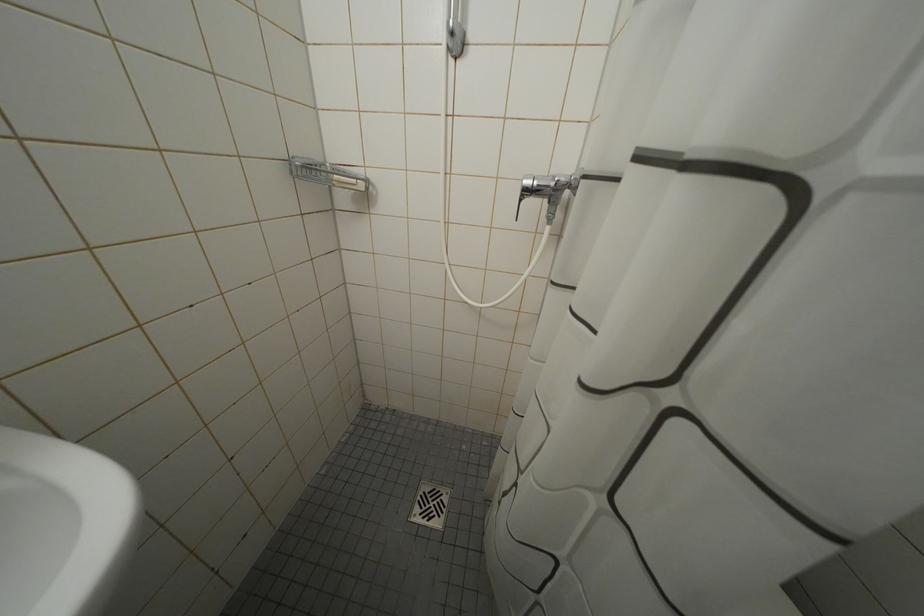
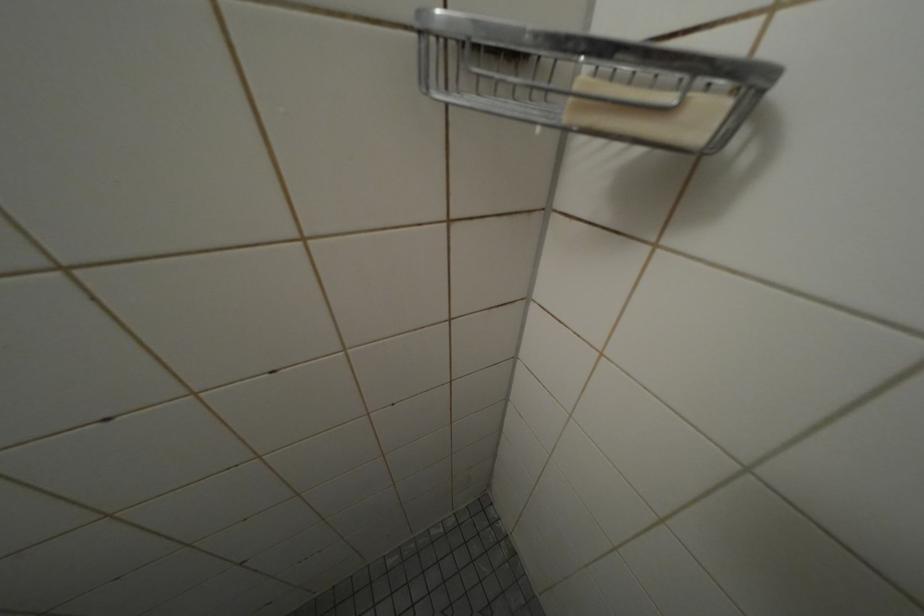
Question: The first image is from the beginning of the video and the second image is from the end. How did the camera likely rotate when shooting the video?

Choices:
 (A) Left
 (B) Right
 (C) Up
 (D) Down

Answer: (A)